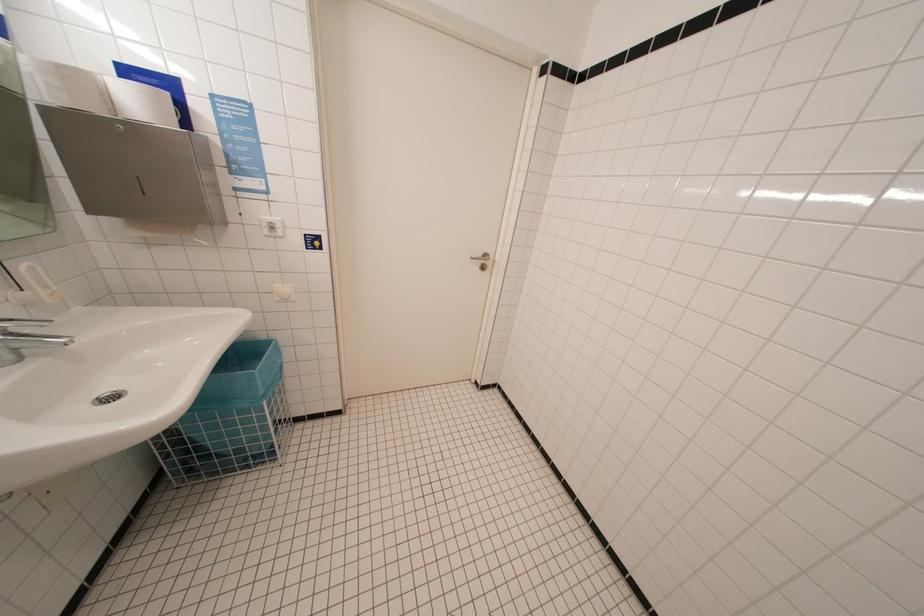
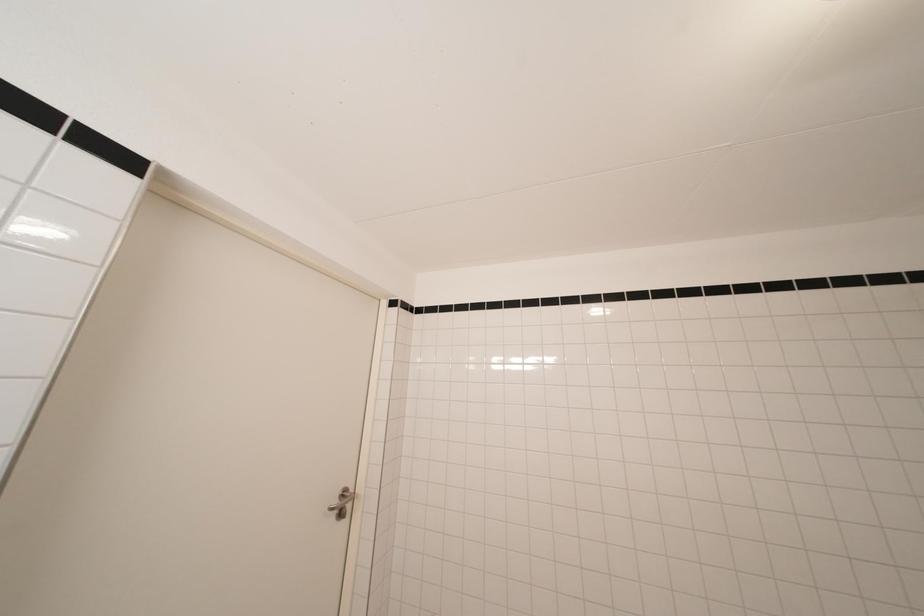
Based on the continuous images, in which direction is the camera rotating?

The rotation direction of the camera is right-up.